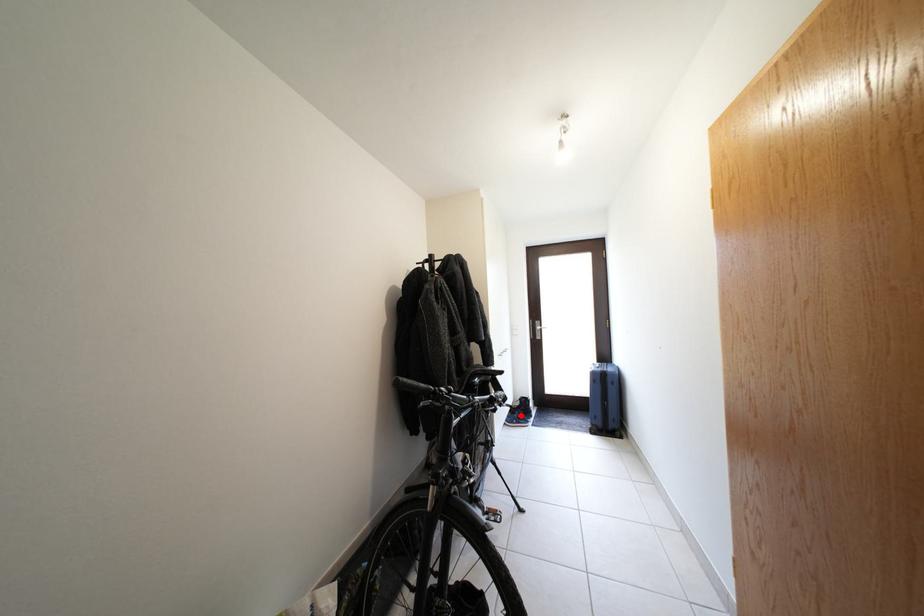
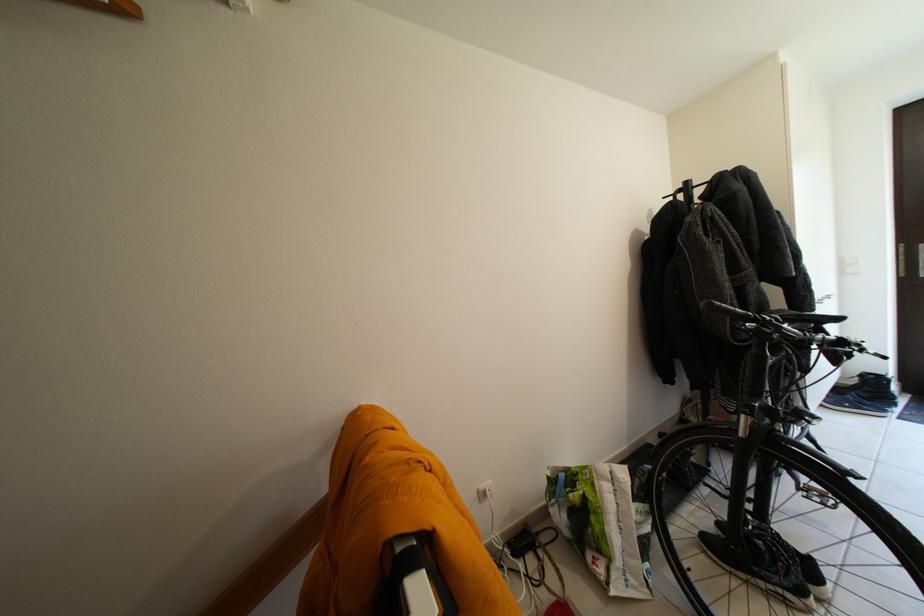
Locate, in the second image, the point that corresponds to the highlighted location in the first image.

(845, 395)